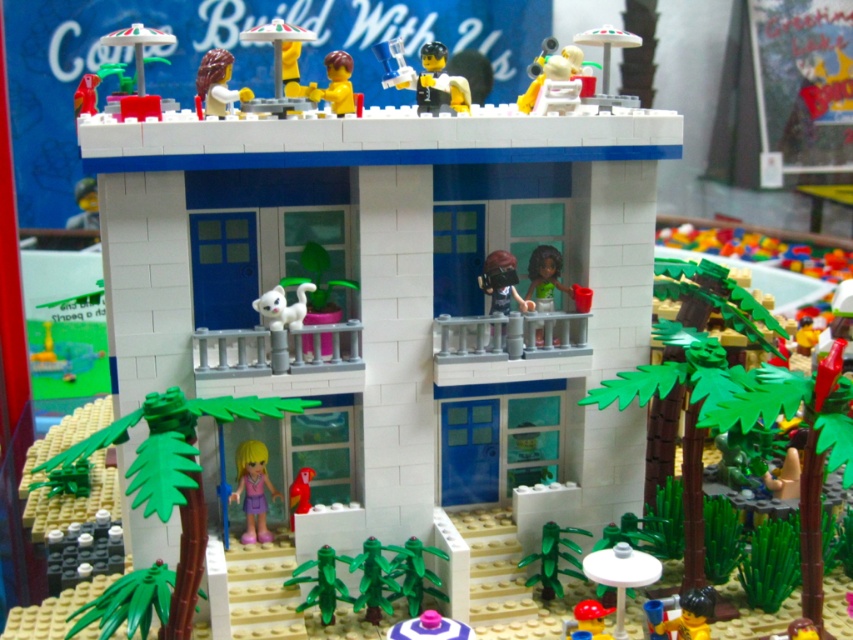
Which is below, yellow matte umbrella at upper center or smooth plastic minifigure at lower right?

smooth plastic minifigure at lower right

Is point (276, 28) in front of point (683, 593)?

No, (276, 28) is behind (683, 593).

Identify the location of yellow matte umbrella at upper center. The width and height of the screenshot is (853, 640). (277, 67).

Who is taller, green plastic plant at lower center or brown matte hair at upper center?

Standing taller between the two is green plastic plant at lower center.

Is green plastic plant at lower center positioned in front of brown matte hair at upper center?

Yes, green plastic plant at lower center is in front of brown matte hair at upper center.

Who is more forward, (370,561) or (233,92)?

Point (370,561) is in front.

Locate an element on the screen. The width and height of the screenshot is (853, 640). green plastic plant at lower center is located at coordinates 373,579.

Can you confirm if pastel purple plastic girl at lower center is thinner than brown matte helmet at upper center?

Yes.

Can you confirm if pastel purple plastic girl at lower center is positioned above brown matte helmet at upper center?

No.

Who is more distant from viewer, (x=251, y=525) or (x=502, y=284)?

The point (x=502, y=284) is more distant.

Find the location of a particular element. This screenshot has height=640, width=853. pastel purple plastic girl at lower center is located at coordinates (253, 490).